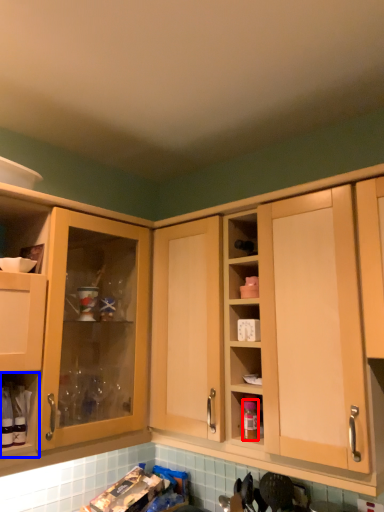
Question: Among these objects, which one is nearest to the camera, bottle (highlighted by a red box) or cabinet (highlighted by a blue box)?

Choices:
 (A) bottle
 (B) cabinet

Answer: (B)